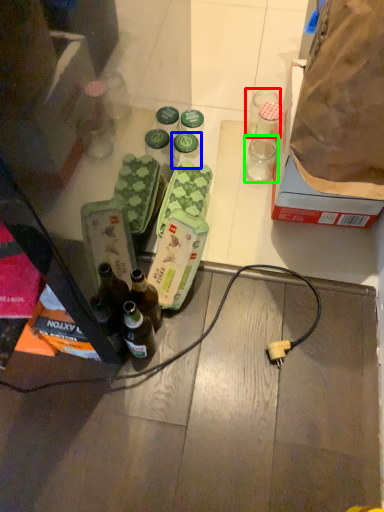
Question: Which object is the farthest from coffee cup (highlighted by a red box)? Choose among these: bottle (highlighted by a blue box) or coffee cup (highlighted by a green box).

Choices:
 (A) bottle
 (B) coffee cup

Answer: (A)